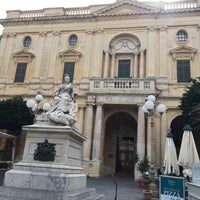
The height and width of the screenshot is (200, 200). What are the coordinates of `lamp bulbs` in the screenshot? It's located at (148, 108), (150, 98), (159, 107), (144, 111), (38, 100), (45, 106), (35, 109), (29, 104).